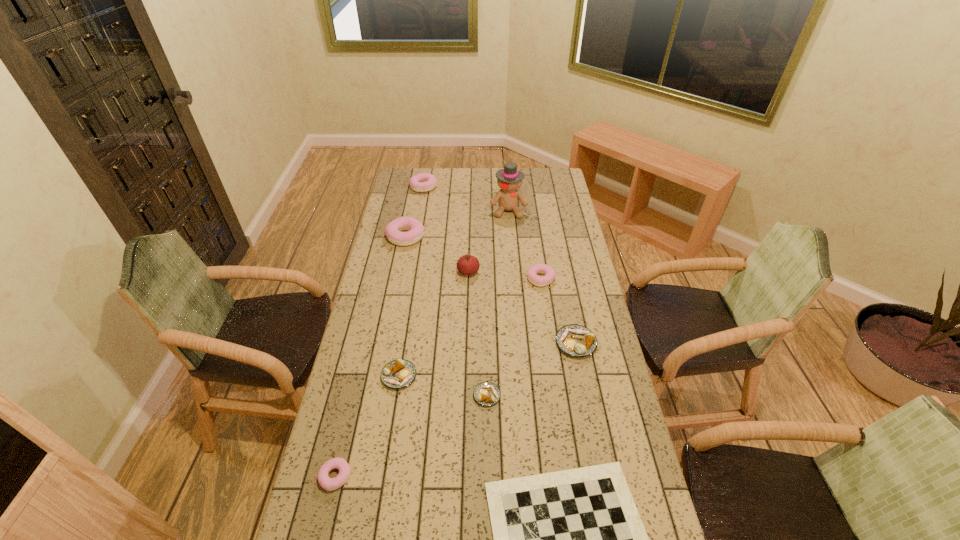
In the image, there is a desktop. Where is `free space at the right edge`? The image size is (960, 540). free space at the right edge is located at coordinates pos(555,264).

Locate an element on the screen. Image resolution: width=960 pixels, height=540 pixels. vacant space at the far right corner is located at coordinates (550, 173).

Find the location of a particular element. vacant area that lies between the biggest pink pastry and the biggest brown pastry is located at coordinates (491, 290).

At what (x,y) coordinates should I click in order to perform the action: click on vacant area that lies between the second smallest brown pastry and the farthest pastry. Please return your answer as a coordinate pair (x, y). The image size is (960, 540). Looking at the image, I should click on (412, 281).

In order to click on vacant point located between the nearest pastry and the tallest pastry in this screenshot , I will do `click(371, 356)`.

Locate an element on the screen. The image size is (960, 540). empty space between the ninth nearest object and the nearest pastry is located at coordinates (422, 343).

The height and width of the screenshot is (540, 960). I want to click on free area in between the third farthest pastry and the smallest brown pastry, so click(x=514, y=337).

In order to click on vacant area that lies between the smallest brown pastry and the rightmost pink pastry in this screenshot , I will do `click(514, 337)`.

Identify which object is the third closest to the smallest brown pastry. Please provide its 2D coordinates. Your answer should be formatted as a tuple, i.e. [(x, y)], where the tuple contains the x and y coordinates of a point satisfying the conditions above.

[(575, 340)]

This screenshot has width=960, height=540. I want to click on object that stands as the fifth closest to the farthest pastry, so click(x=575, y=340).